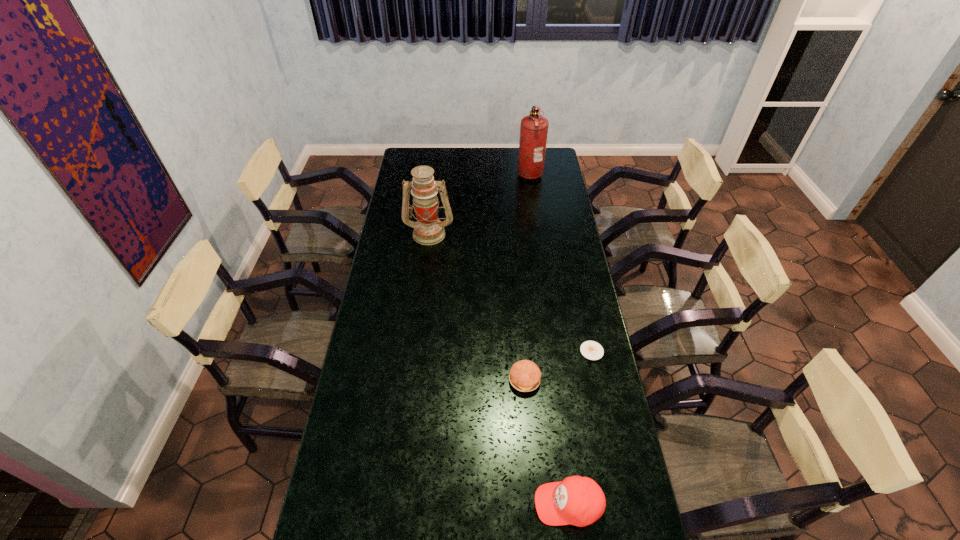
Where is `vacant point located between the fourth farthest object and the farthest object`? This screenshot has height=540, width=960. vacant point located between the fourth farthest object and the farthest object is located at coordinates (527, 276).

You are a GUI agent. You are given a task and a screenshot of the screen. Output one action in this format:
    pyautogui.click(x=<x>, y=<y>)
    Task: Click on the vacant area that lies between the rightmost object and the leftmost object
    This screenshot has width=960, height=540.
    Given the screenshot: What is the action you would take?
    pyautogui.click(x=511, y=292)

Where is `free space between the nearest object and the second shortest object`? Image resolution: width=960 pixels, height=540 pixels. free space between the nearest object and the second shortest object is located at coordinates (546, 442).

Where is `free spot between the fourth farthest object and the third shortest object`? free spot between the fourth farthest object and the third shortest object is located at coordinates (546, 442).

Identify the location of vacant area that lies between the fourth nearest object and the hamburger. (477, 307).

The height and width of the screenshot is (540, 960). What are the coordinates of `free spot between the fourth shortest object and the fire extinguisher` in the screenshot? It's located at (479, 203).

This screenshot has width=960, height=540. What are the coordinates of `free space between the oil lamp and the shortest object` in the screenshot? It's located at [511, 292].

Where is `vacant area that lies between the hamburger and the leftmost object`? This screenshot has width=960, height=540. vacant area that lies between the hamburger and the leftmost object is located at coordinates 477,307.

Select which object appears as the fourth closest to the leftmost object. Please provide its 2D coordinates. Your answer should be formatted as a tuple, i.e. [(x, y)], where the tuple contains the x and y coordinates of a point satisfying the conditions above.

[(580, 501)]

Where is `object that is the closest to the fire extinguisher`? This screenshot has width=960, height=540. object that is the closest to the fire extinguisher is located at coordinates (428, 230).